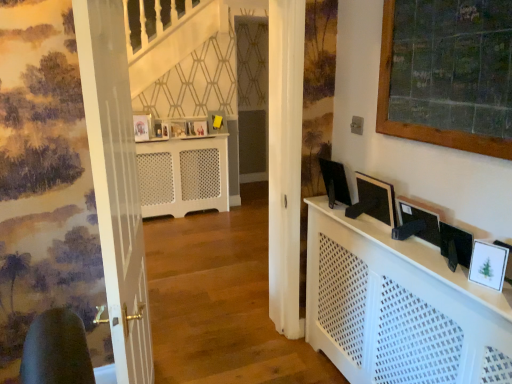
You are a GUI agent. You are given a task and a screenshot of the screen. Output one action in this format:
    pyautogui.click(x=<x>, y=<y>)
    Task: Click on the vacant area on the back side of matte wooden picture frame at center, the third picture frame when ordered from bottom to top
    
    Given the screenshot: What is the action you would take?
    pyautogui.click(x=184, y=133)